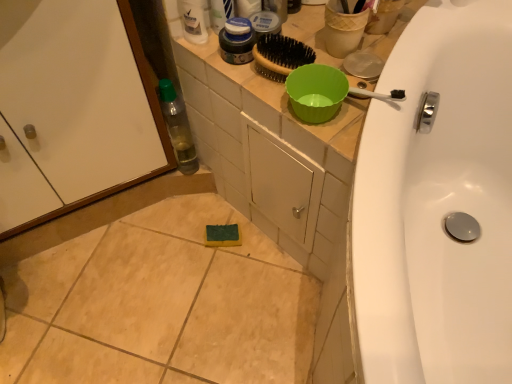
Question: Is matte plastic mouthwash at upper center oriented away from matte blue jar at upper center?

Choices:
 (A) yes
 (B) no

Answer: (A)

Question: From a real-world perspective, is matte plastic mouthwash at upper center positioned under matte blue jar at upper center based on gravity?

Choices:
 (A) yes
 (B) no

Answer: (A)

Question: Is matte plastic mouthwash at upper center to the right of matte blue jar at upper center from the viewer's perspective?

Choices:
 (A) no
 (B) yes

Answer: (B)

Question: Could matte blue jar at upper center be considered to be inside matte plastic mouthwash at upper center?

Choices:
 (A) no
 (B) yes

Answer: (A)

Question: Considering the relative sizes of matte plastic mouthwash at upper center and matte blue jar at upper center in the image provided, is matte plastic mouthwash at upper center thinner than matte blue jar at upper center?

Choices:
 (A) yes
 (B) no

Answer: (B)

Question: Considering the relative sizes of matte plastic mouthwash at upper center and matte blue jar at upper center in the image provided, is matte plastic mouthwash at upper center taller than matte blue jar at upper center?

Choices:
 (A) yes
 (B) no

Answer: (B)

Question: Does matte plastic mouthwash at upper center lie behind white glossy screen door at lower left?

Choices:
 (A) yes
 (B) no

Answer: (A)

Question: Is matte plastic mouthwash at upper center aimed at white glossy screen door at lower left?

Choices:
 (A) no
 (B) yes

Answer: (A)

Question: Is matte plastic mouthwash at upper center outside of white glossy screen door at lower left?

Choices:
 (A) no
 (B) yes

Answer: (B)

Question: Does matte plastic mouthwash at upper center have a greater width compared to white glossy screen door at lower left?

Choices:
 (A) yes
 (B) no

Answer: (B)

Question: Is matte plastic mouthwash at upper center far from white glossy screen door at lower left?

Choices:
 (A) yes
 (B) no

Answer: (B)

Question: From the image's perspective, is matte plastic mouthwash at upper center over white glossy screen door at lower left?

Choices:
 (A) yes
 (B) no

Answer: (A)

Question: Does white glossy bottle at upper center have a greater height compared to matte blue jar at upper center?

Choices:
 (A) no
 (B) yes

Answer: (A)